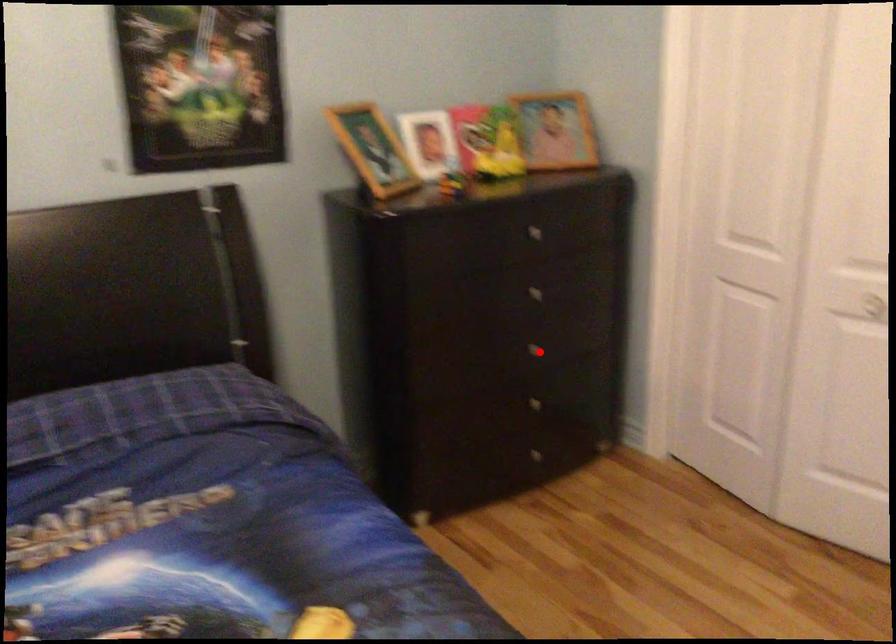
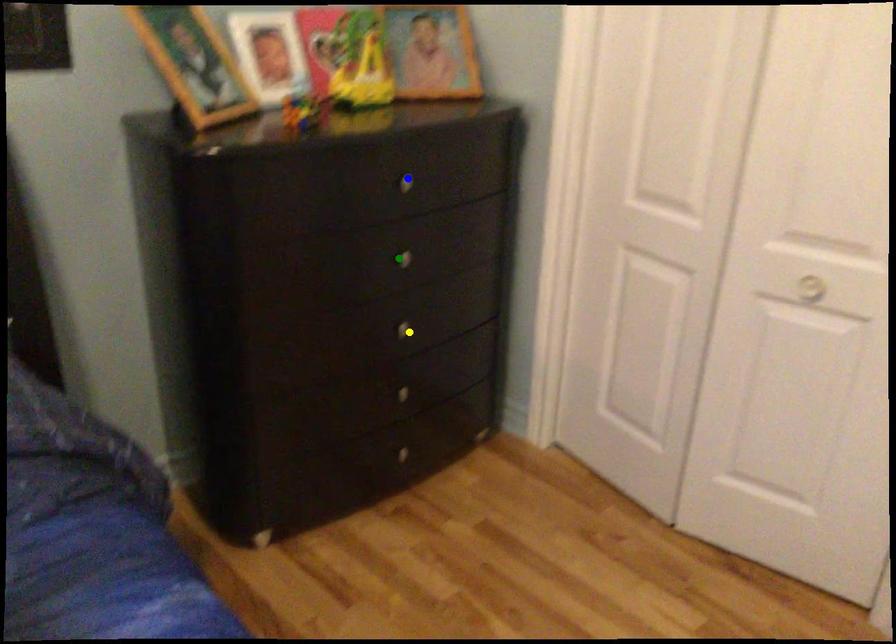
Question: I am providing you with two images of the same scene from different viewpoints. A red point is marked on the first image. You are given multiple points on the second image. Which point in image 2 represents the same 3d spot as the red point in image 1?

Choices:
 (A) green point
 (B) blue point
 (C) yellow point

Answer: (C)